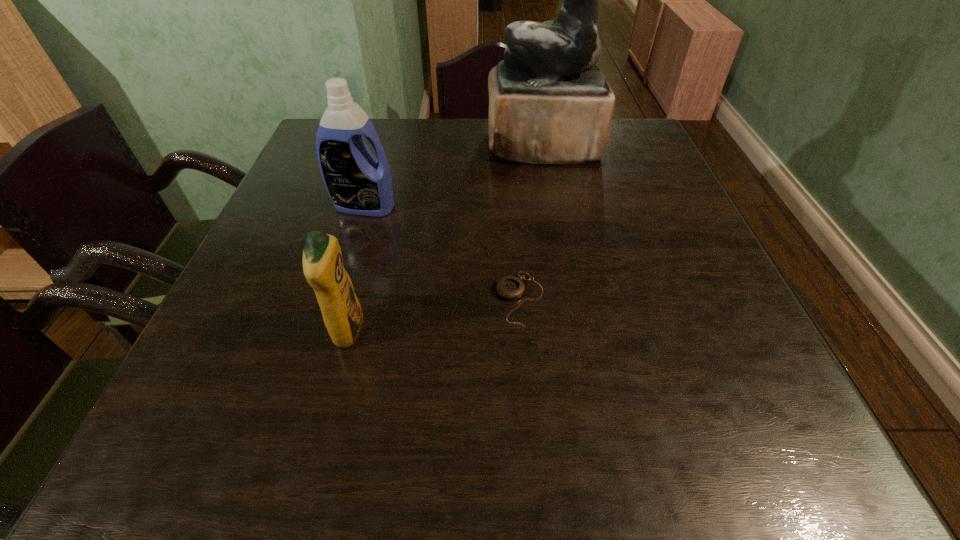
At what (x,y) coordinates should I click in order to perform the action: click on vacant area at the right edge of the desktop. Please return your answer as a coordinate pair (x, y). The image size is (960, 540). Looking at the image, I should click on (663, 195).

In order to click on vacant space at the near right corner of the desktop in this screenshot , I will do `click(767, 460)`.

At what (x,y) coordinates should I click in order to perform the action: click on free space between the shortest object and the second shortest object. Please return your answer as a coordinate pair (x, y). The image size is (960, 540). Looking at the image, I should click on (434, 315).

Locate an element on the screen. unoccupied position between the pocket watch and the shorter detergent is located at coordinates (434, 315).

At what (x,y) coordinates should I click in order to perform the action: click on free space that is in between the pocket watch and the shorter detergent. Please return your answer as a coordinate pair (x, y). Image resolution: width=960 pixels, height=540 pixels. Looking at the image, I should click on (434, 315).

Find the location of a particular element. empty space between the shorter detergent and the sculpture is located at coordinates (445, 238).

This screenshot has width=960, height=540. I want to click on free space that is in between the second shortest object and the shortest object, so click(434, 315).

Where is `empty space between the pocket watch and the shorter detergent`? This screenshot has width=960, height=540. empty space between the pocket watch and the shorter detergent is located at coordinates (434, 315).

Locate an element on the screen. The width and height of the screenshot is (960, 540). free area in between the second tallest object and the nearer detergent is located at coordinates pyautogui.click(x=356, y=269).

Find the location of `free space between the shorter detergent and the shortest object`. free space between the shorter detergent and the shortest object is located at coordinates (434, 315).